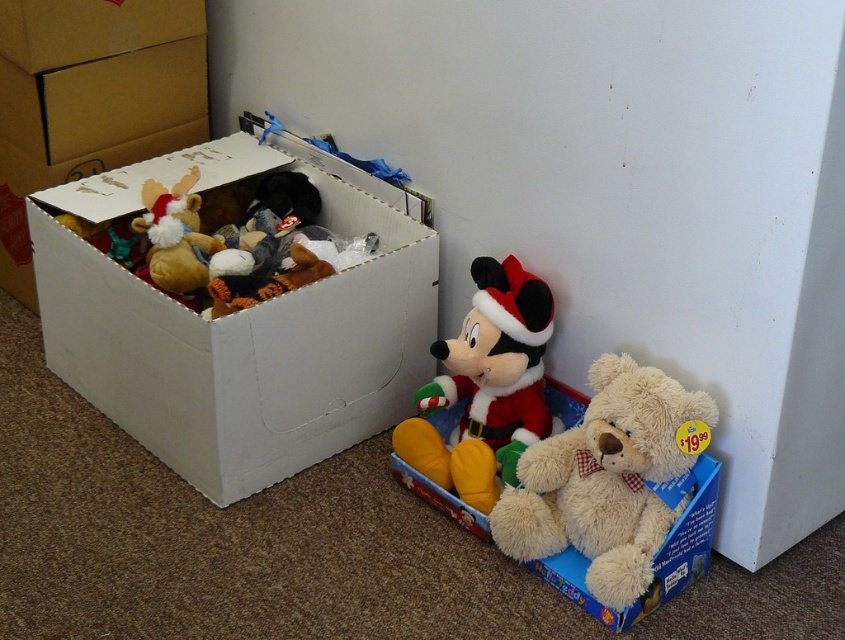
You are organizing the storage area and need to move the white cardboard box at upper left and the fluffy beige teddy bear at lower right. Which object should you move first if you want to reach the teddy bear without moving the box first?

You should move the white cardboard box at upper left first because it is closer to you than the fluffy beige teddy bear at lower right, so moving it first will allow access to the teddy bear.

You are a delivery person who needs to place a new package at the storage area. The package is 0.3 meters wide. Can you place it at point (238, 326) without overlapping with the white cardboard box at left?

The point (238, 326) is where the white cardboard box at left is located. Since the package would overlap with the existing box, it cannot be placed there.

You are organizing a childrens Christmas party and need to stack decorations. You have a white cardboard box at upper left and a fluffy beige teddy bear at lower right. Which item can be placed on top of the other without falling over?

The white cardboard box at upper left has a greater height compared to the fluffy beige teddy bear at lower right, so placing the teddy bear on top of the box might be unstable. However, since the box is taller, it could provide a stable base if placed on a lower level. For stability, the fluffy beige teddy bear at lower right should be placed on top of the white cardboard box at upper left as long as the box is sturdy enough to support its weight.